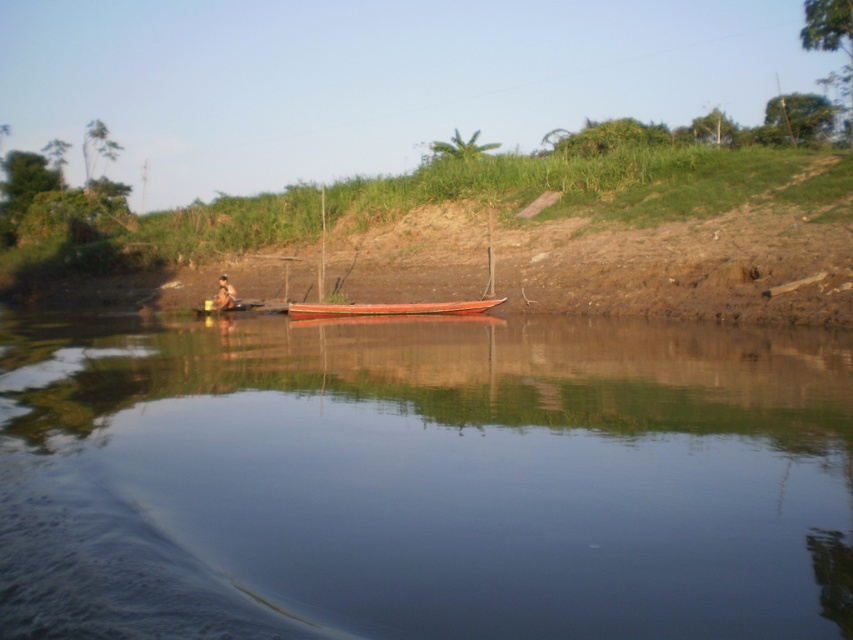
You are standing at the origin point of the coordinate system placed at the bottom left corner of the image. You want to locate the smooth wooden canoe at center. What are its coordinates?

The smooth wooden canoe at center is located at coordinates point (387, 308).

You are planning to take a boat ride on the river shown in the image. The smooth wooden canoe at center and the brown wooden person at lower left are visible. Which object would be more suitable for carrying multiple people?

The smooth wooden canoe at center is bigger than the brown wooden person at lower left, so it would be more suitable for carrying multiple people.

From the picture: You are standing on the riverbank and want to reach the smooth wooden canoe at center. Which direction should you walk to get there from the smooth water at center?

The smooth wooden canoe at center is to the right of the smooth water at center, so you should walk to the right to reach it.